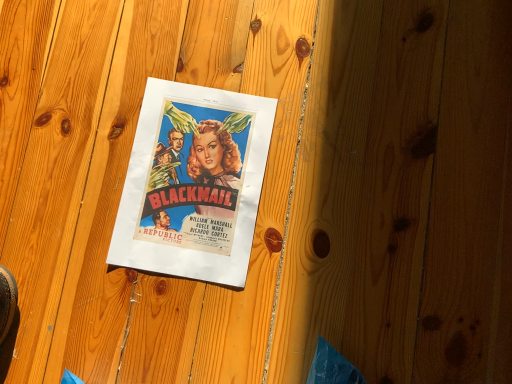
Where is `empty space that is ontop of matte paper poster at center`? The height and width of the screenshot is (384, 512). empty space that is ontop of matte paper poster at center is located at coordinates (192, 178).